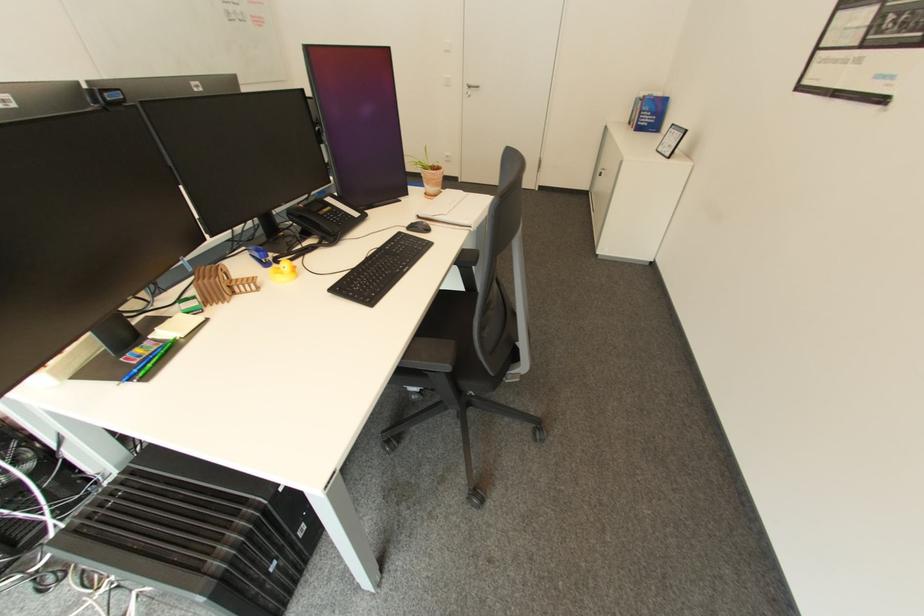
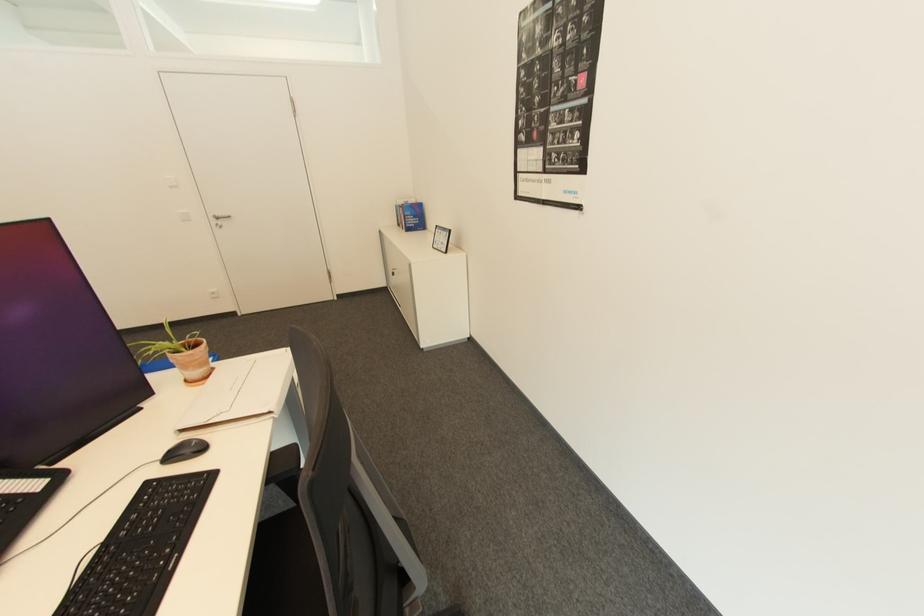
Question: The camera is either moving clockwise (left) or counter-clockwise (right) around the object. The first image is from the beginning of the video and the second image is from the end. Is the camera moving left or right when shooting the video?

Choices:
 (A) Left
 (B) Right

Answer: (A)